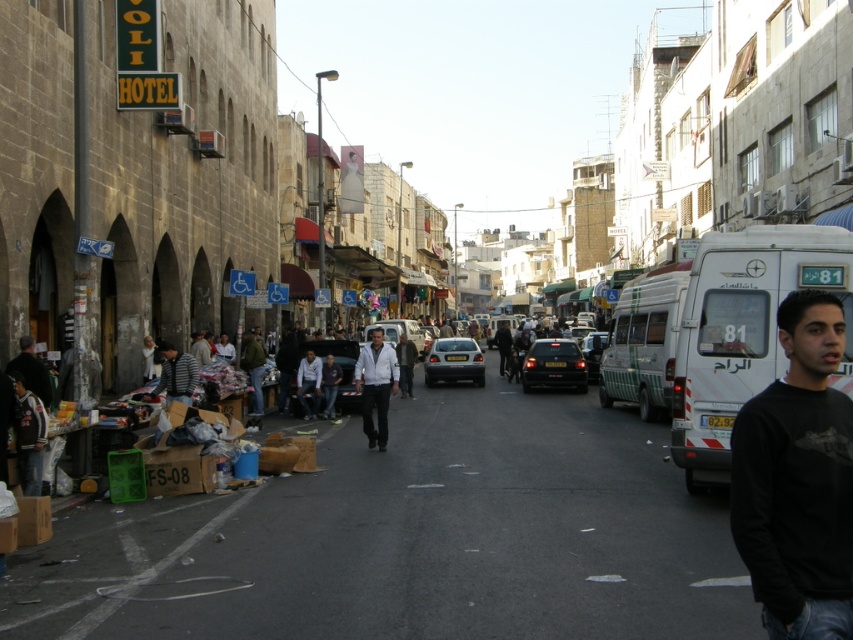
Which is more to the left, light blue fabric jacket at center or black glossy car at center?

From the viewer's perspective, light blue fabric jacket at center appears more on the left side.

Between light blue fabric jacket at center and black glossy car at center, which one is positioned lower?

black glossy car at center

Who is more distant from viewer, (299,376) or (596,362)?

The point (596,362) is behind.

I want to click on light blue fabric jacket at center, so click(309, 384).

Does point (637, 300) come farther from viewer compared to point (325, 388)?

No, (637, 300) is closer to viewer.

Describe the element at coordinates (643, 340) in the screenshot. I see `green striped van at center` at that location.

The image size is (853, 640). What do you see at coordinates (643, 340) in the screenshot?
I see `green striped van at center` at bounding box center [643, 340].

Locate an element on the screen. Image resolution: width=853 pixels, height=640 pixels. green striped van at center is located at coordinates (643, 340).

Is light blue fabric jacket at center positioned behind light brown leather jacket at center?

No, light blue fabric jacket at center is in front of light brown leather jacket at center.

The height and width of the screenshot is (640, 853). What do you see at coordinates (309, 384) in the screenshot? I see `light blue fabric jacket at center` at bounding box center [309, 384].

Where is `light blue fabric jacket at center`? light blue fabric jacket at center is located at coordinates (309, 384).